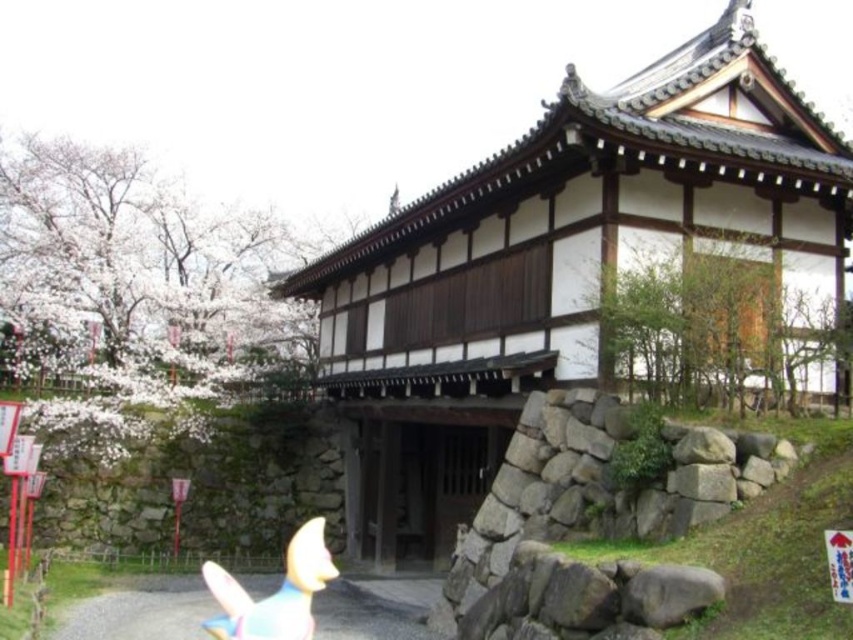
You are standing in front of the traditional Japanese building and want to take a photo of the point at coordinates (659,216). If your camera has a maximum focus range of 15 meters, will it be able to focus on that point?

The distance of point (659,216) from the camera is 13.65 meters, which is within the camera maximum focus range of 15 meters. Therefore, the camera can focus on that point.

You are a visitor approaching the entrance of the white wooden temple at center and the matte yellow plush toy at lower left. Which object will you encounter first as you walk towards the temple?

You will encounter the white wooden temple at center first because it is closer to you than the matte yellow plush toy at lower left, which is further away.